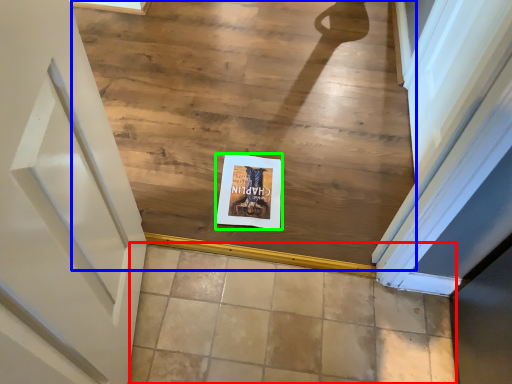
Question: Which object is positioned closest to tile (highlighted by a red box)? Select from stairwell (highlighted by a blue box) and postcard (highlighted by a green box).

Choices:
 (A) stairwell
 (B) postcard

Answer: (B)